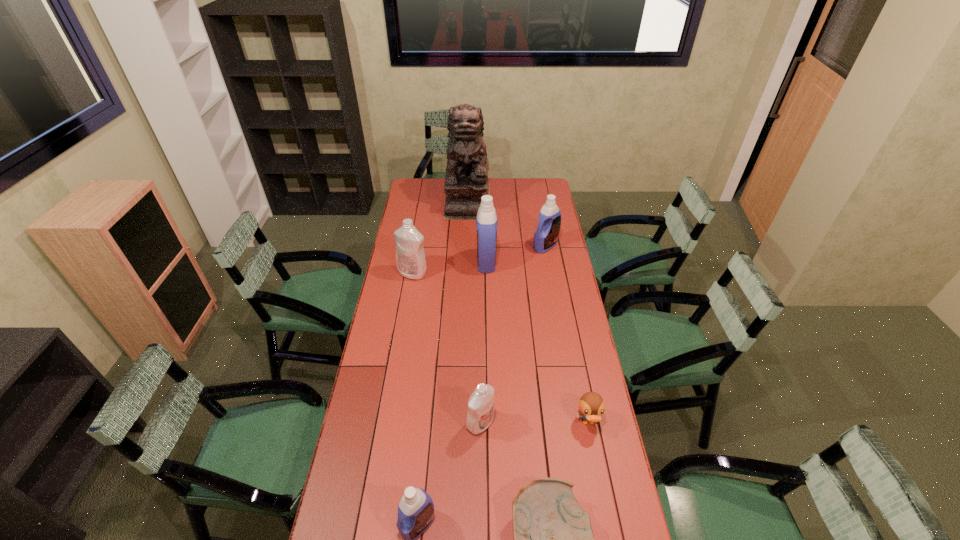
This screenshot has height=540, width=960. I want to click on the tallest object, so click(x=466, y=181).

At what (x,y) coordinates should I click in order to perform the action: click on sculpture. Please return your answer as a coordinate pair (x, y). This screenshot has height=540, width=960. Looking at the image, I should click on coord(466,181).

Find the location of a particular element. Image resolution: width=960 pixels, height=540 pixels. the second tallest object is located at coordinates (486, 220).

The height and width of the screenshot is (540, 960). Find the location of `the tallest detergent`. the tallest detergent is located at coordinates (486, 220).

Image resolution: width=960 pixels, height=540 pixels. I want to click on the bigger white detergent, so click(x=410, y=258).

Where is `the left white detergent`? Image resolution: width=960 pixels, height=540 pixels. the left white detergent is located at coordinates (410, 258).

What are the coordinates of `the rightmost detergent` in the screenshot? It's located at (545, 238).

This screenshot has width=960, height=540. I want to click on the rightmost blue detergent, so click(545, 238).

What are the coordinates of `the smaller white detergent` in the screenshot? It's located at (480, 412).

This screenshot has width=960, height=540. I want to click on the second nearest detergent, so click(480, 412).